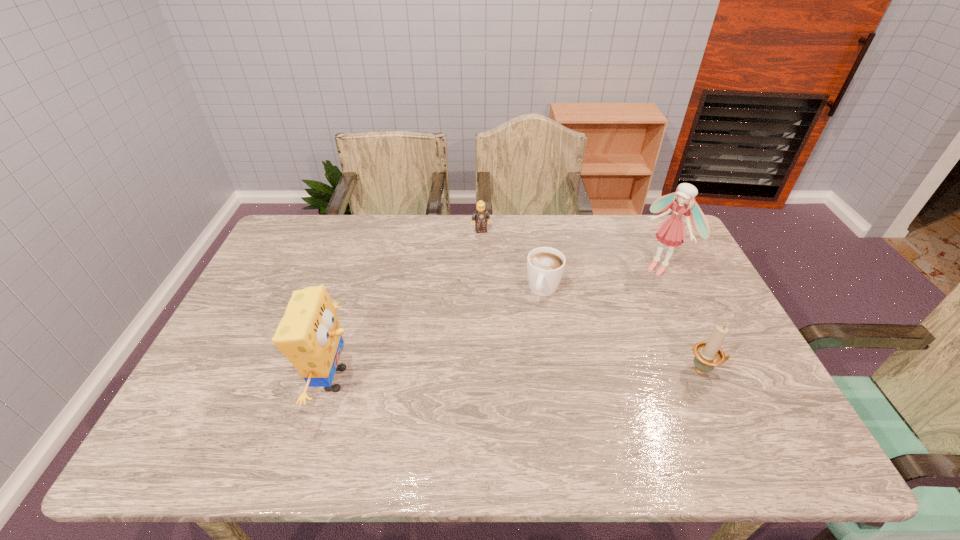
Where is `free space located on the front-facing side of the tallest object`? The image size is (960, 540). free space located on the front-facing side of the tallest object is located at coordinates (608, 307).

Where is `free space located with the handle on the side of the third object from right to left`? free space located with the handle on the side of the third object from right to left is located at coordinates (508, 396).

Where is `free spot located 0.150m with the handle on the side of the third object from right to left`? free spot located 0.150m with the handle on the side of the third object from right to left is located at coordinates (526, 344).

Find the location of a particular element. The image size is (960, 540). free region located with the handle on the side of the third object from right to left is located at coordinates (500, 417).

Where is `blank space located in front of the farthest object`? Image resolution: width=960 pixels, height=540 pixels. blank space located in front of the farthest object is located at coordinates (508, 314).

The image size is (960, 540). Find the location of `free spot located 0.250m in front of the farthest object`. free spot located 0.250m in front of the farthest object is located at coordinates (497, 281).

At what (x,y) coordinates should I click in order to perform the action: click on free space located 0.110m in front of the farthest object. Please return your answer as a coordinate pair (x, y). Looking at the image, I should click on (489, 253).

Image resolution: width=960 pixels, height=540 pixels. In order to click on doll at the far edge in this screenshot , I will do `click(671, 232)`.

I want to click on Lego that is at the far edge, so click(x=481, y=215).

Where is `object that is at the near edge`? This screenshot has height=540, width=960. object that is at the near edge is located at coordinates (309, 334).